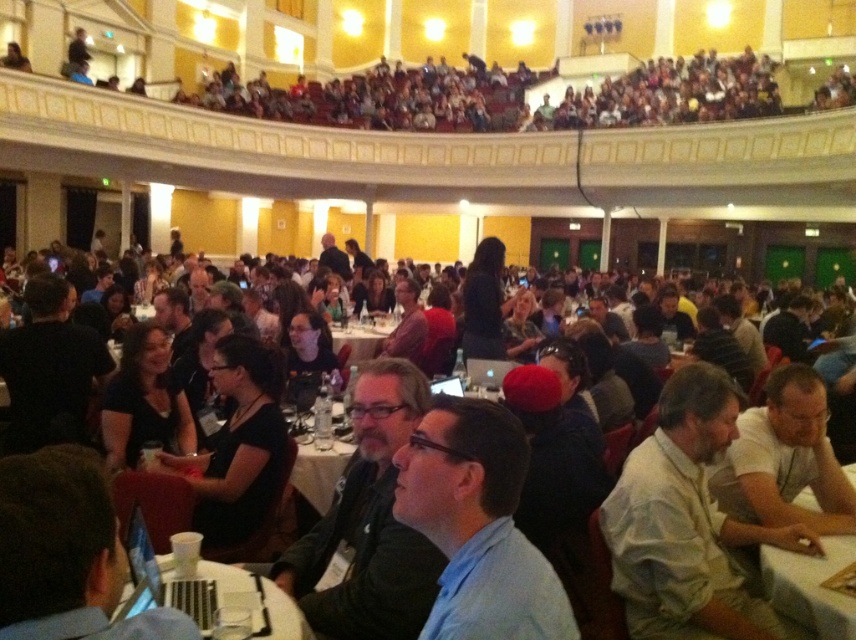
Question: Which point is farther to the camera?

Choices:
 (A) white plastic table at center
 (B) white plastic table at lower center
 (C) white cloth table at lower right

Answer: (A)

Question: Is white plastic table at lower center wider than white plastic table at center?

Choices:
 (A) no
 (B) yes

Answer: (A)

Question: Does white cloth table at lower right appear on the left side of white plastic table at center?

Choices:
 (A) no
 (B) yes

Answer: (A)

Question: Is white cloth table at lower right smaller than white plastic table at lower center?

Choices:
 (A) no
 (B) yes

Answer: (A)

Question: Based on their relative distances, which object is nearer to the white plastic table at center?

Choices:
 (A) white cloth table at lower right
 (B) white plastic table at lower center

Answer: (B)

Question: Which of these objects is positioned farthest from the white cloth table at lower right?

Choices:
 (A) white plastic table at center
 (B) white plastic table at lower center

Answer: (A)